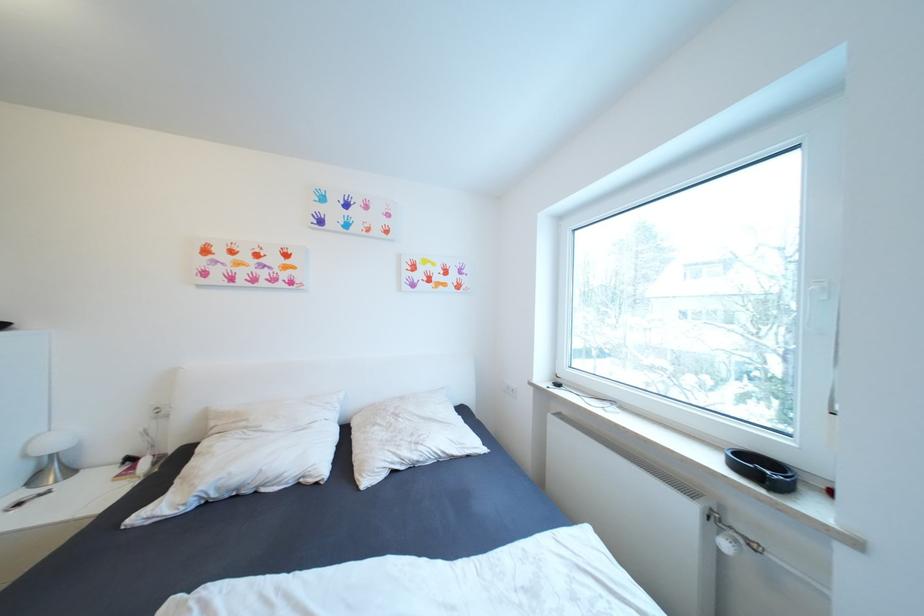
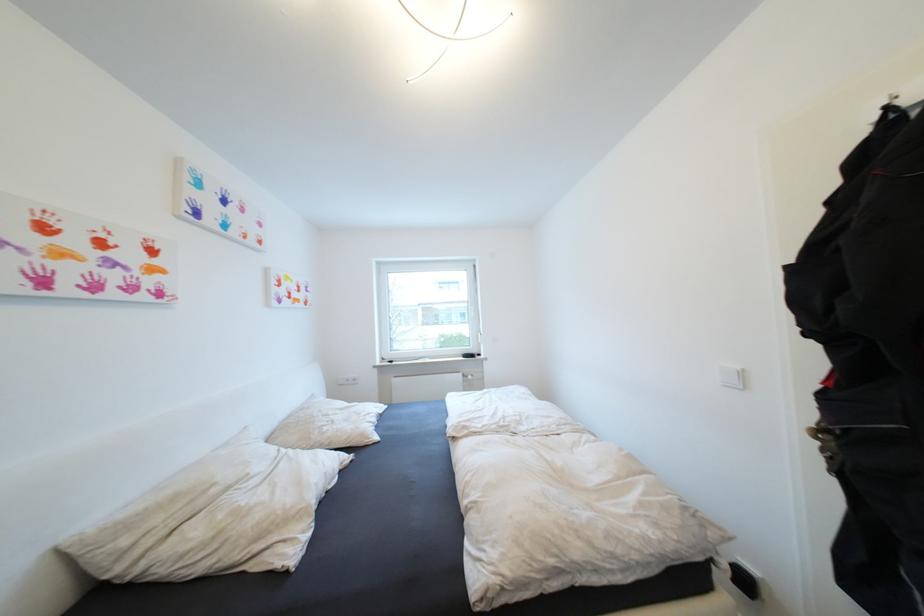
Locate, in the second image, the point that corresponds to the point at 397,427 in the first image.

(339, 423)